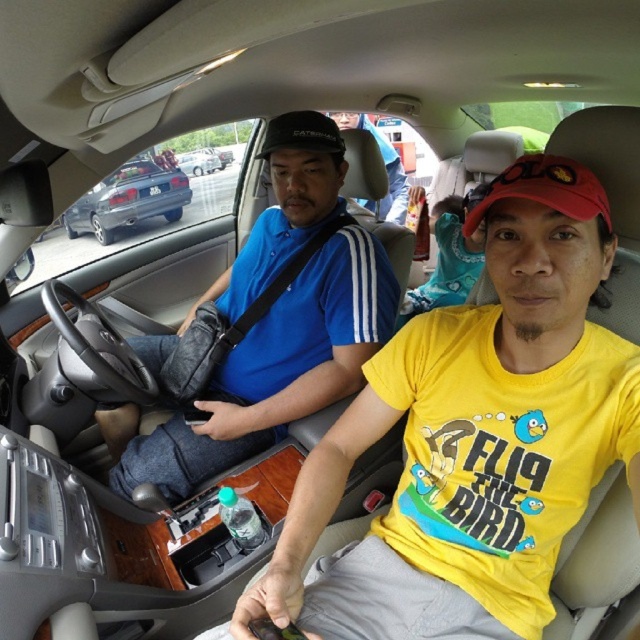
Question: Which of these objects is positioned closest to the blue fabric shirt at center?

Choices:
 (A) matte blue shirt at center
 (B) black matte baseball cap at center
 (C) clear plastic bottle at center
 (D) metallic blue minivan at left

Answer: (B)

Question: Is metallic blue minivan at left to the left of clear plastic bottle at center from the viewer's perspective?

Choices:
 (A) no
 (B) yes

Answer: (B)

Question: Among these objects, which one is farthest from the camera?

Choices:
 (A) clear plastic bottle at center
 (B) black matte baseball cap at center
 (C) blue fabric shirt at center
 (D) yellow matte t-shirt at center

Answer: (B)

Question: Which of the following is the farthest from the observer?

Choices:
 (A) (220, 308)
 (B) (330, 125)
 (C) (522, 284)

Answer: (A)

Question: Does metallic blue minivan at left have a larger size compared to clear plastic bottle at center?

Choices:
 (A) no
 (B) yes

Answer: (B)

Question: From the image, what is the correct spatial relationship of metallic blue minivan at left in relation to clear plastic bottle at center?

Choices:
 (A) right
 (B) left

Answer: (B)